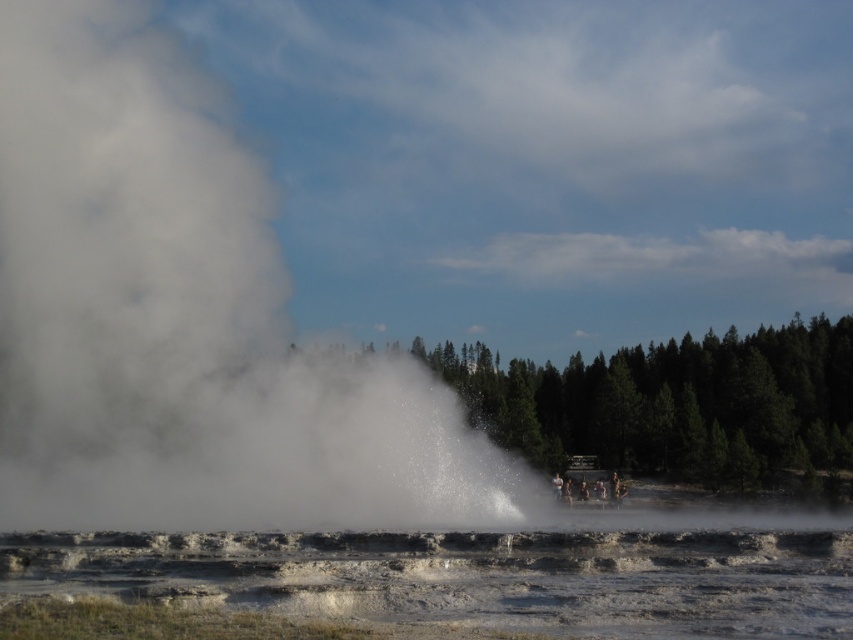
Question: Can you confirm if white vapor at center is smaller than white frothy water at center?

Choices:
 (A) yes
 (B) no

Answer: (B)

Question: From the image, what is the correct spatial relationship of white vapor at center in relation to white frothy water at center?

Choices:
 (A) above
 (B) below

Answer: (A)

Question: Which object is farther from the camera taking this photo?

Choices:
 (A) white frothy water at center
 (B) white vapor at center

Answer: (B)

Question: Where is white vapor at center located in relation to white frothy water at center in the image?

Choices:
 (A) below
 (B) above

Answer: (B)